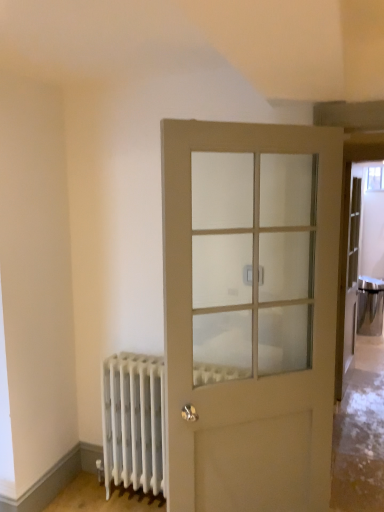
Question: Is white matte radiator at lower left taller or shorter than satin silver door handle at center?

Choices:
 (A) short
 (B) tall

Answer: (B)

Question: Is white matte radiator at lower left inside the boundaries of satin silver door handle at center, or outside?

Choices:
 (A) outside
 (B) inside

Answer: (A)

Question: Considering the real-world distances, which object is closest to the matte white door at center?

Choices:
 (A) satin silver door handle at center
 (B) white matte radiator at lower left

Answer: (A)

Question: Estimate the real-world distances between objects in this image. Which object is closer to the satin silver door handle at center?

Choices:
 (A) white matte radiator at lower left
 (B) matte white door at center

Answer: (B)